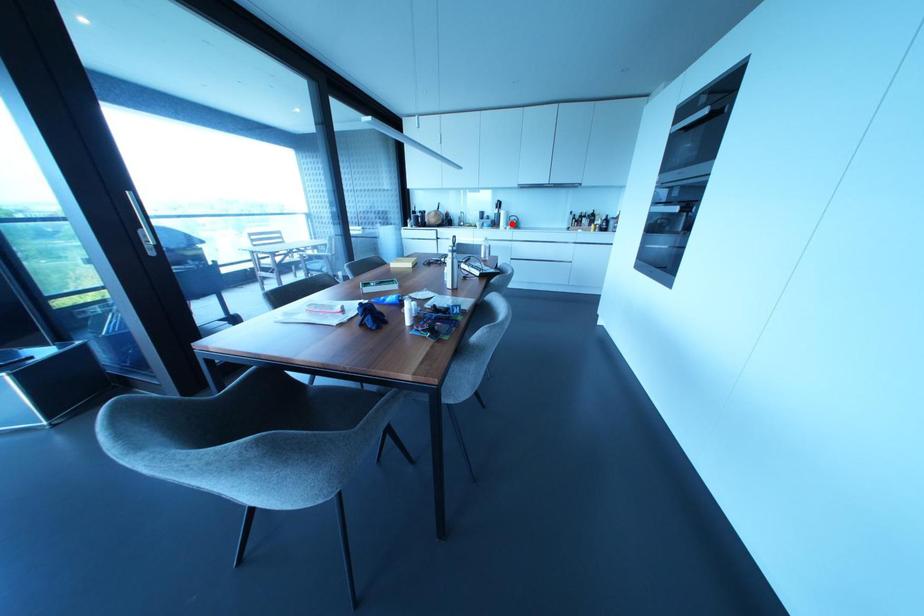
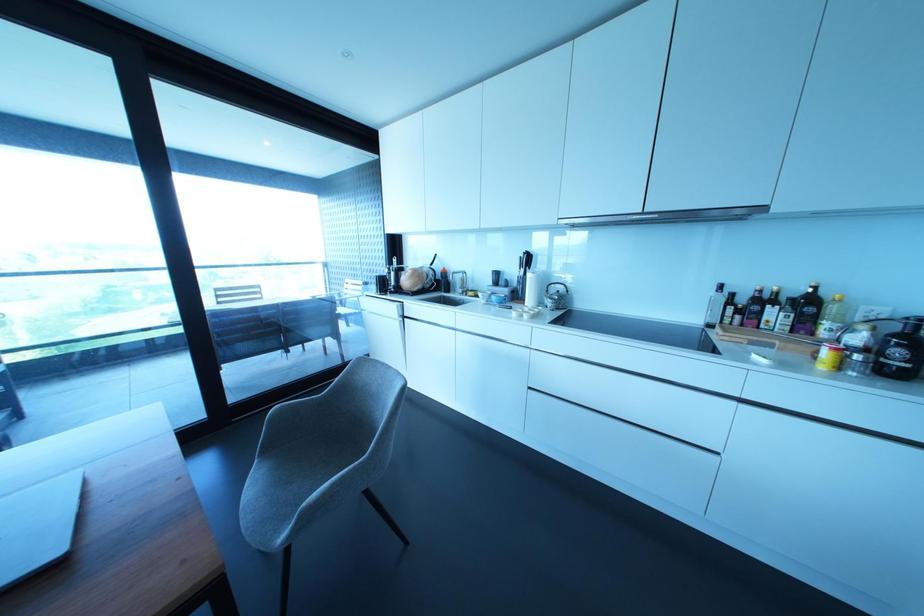
Find the pixel in the second image that matches the highlighted location in the first image.

(549, 302)